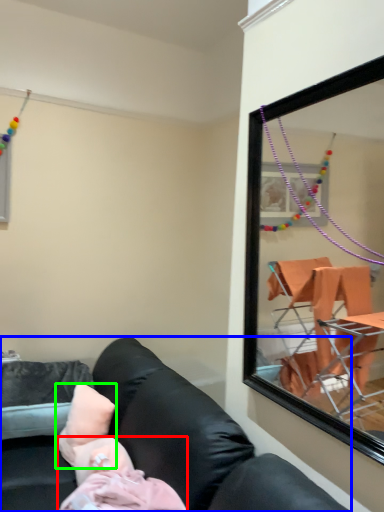
Question: Which object is positioned closest to person (highlighted by a red box)? Select from studio couch (highlighted by a blue box) and pillow (highlighted by a green box).

Choices:
 (A) studio couch
 (B) pillow

Answer: (A)